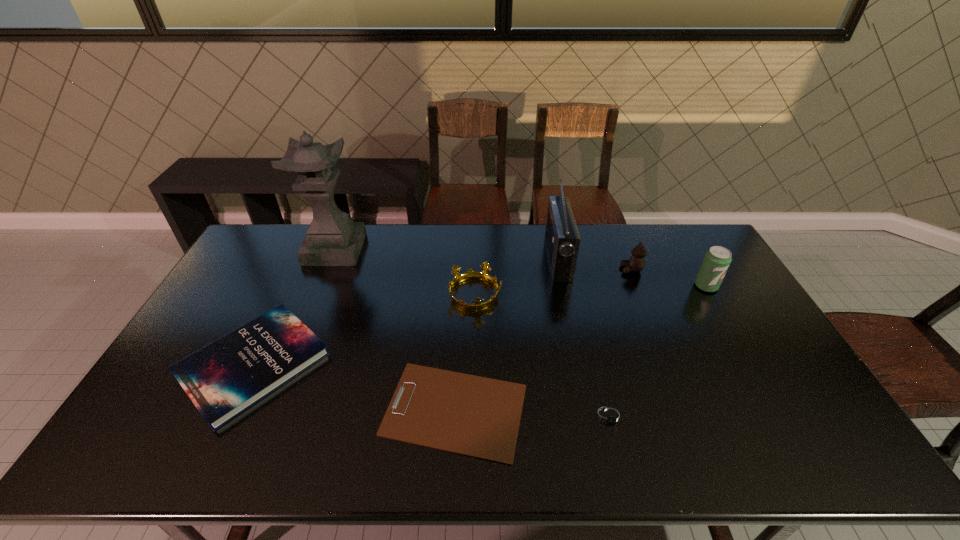
Where is `vacant region at the left edge of the desktop`? vacant region at the left edge of the desktop is located at coordinates click(259, 264).

This screenshot has width=960, height=540. I want to click on vacant region at the far left corner of the desktop, so click(262, 231).

Where is `free spot at the far right corner of the desktop`? Image resolution: width=960 pixels, height=540 pixels. free spot at the far right corner of the desktop is located at coordinates (690, 246).

The image size is (960, 540). In order to click on free spot between the second shortest object and the sculpture in this screenshot , I will do `click(472, 333)`.

The image size is (960, 540). I want to click on blank region between the hardback book and the seventh object from left to right, so click(x=443, y=316).

At what (x,y) coordinates should I click in order to perform the action: click on free space between the sculpture and the crown. Please return your answer as a coordinate pair (x, y). The width and height of the screenshot is (960, 540). Looking at the image, I should click on (405, 272).

The image size is (960, 540). I want to click on vacant area that lies between the second tallest object and the soda, so click(632, 273).

The width and height of the screenshot is (960, 540). Identify the location of free space between the sculpture and the watch. (472, 333).

The width and height of the screenshot is (960, 540). I want to click on unoccupied area between the tallest object and the soda, so click(520, 268).

Where is `vacant region between the hardback book and the shortest object`? vacant region between the hardback book and the shortest object is located at coordinates (354, 387).